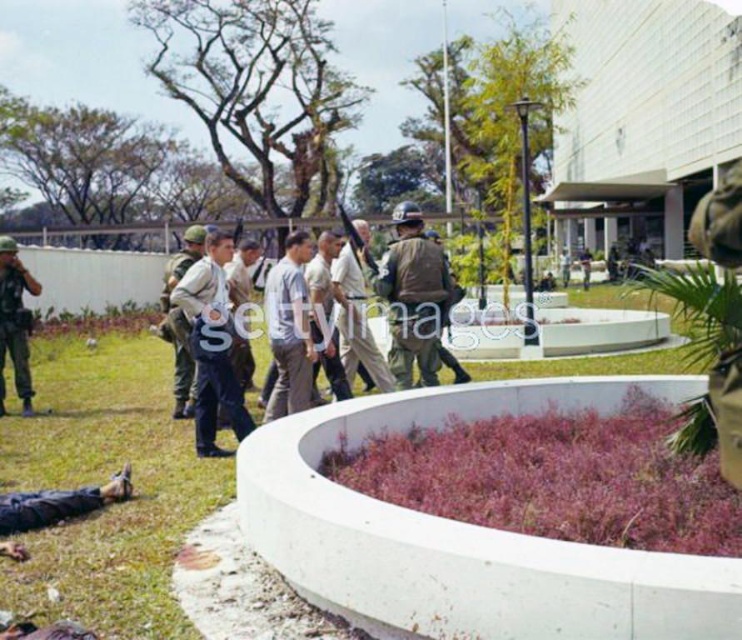
Based on the photo, you are a photographer positioned to the front of the scene. You need to capture a photo that includes both the light gray cotton shirt at center and the camouflage uniform at left. Based on their positions, which object should you adjust your camera to focus on first to ensure both are in frame?

The light gray cotton shirt at center is to the right of the camouflage uniform at left. To include both in the frame, focus on the camouflage uniform at left first since it is on the left side, ensuring there is enough space to include the light gray cotton shirt at center to its right.

You are standing in the park and see two people dressed in light brown uniform at center and light gray cotton shirt at center. Which one is nearer to you?

The light brown uniform at center is closer to the viewer than the light gray cotton shirt at center.